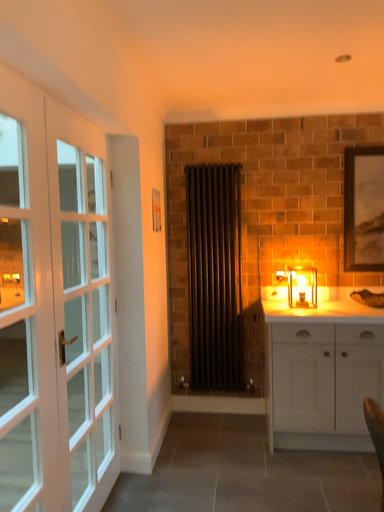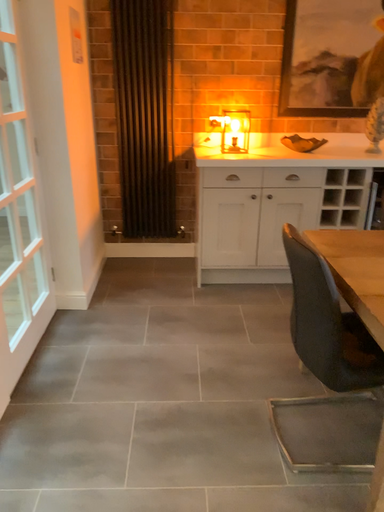
Question: How did the camera likely rotate when shooting the video?

Choices:
 (A) rotated right
 (B) rotated left

Answer: (A)